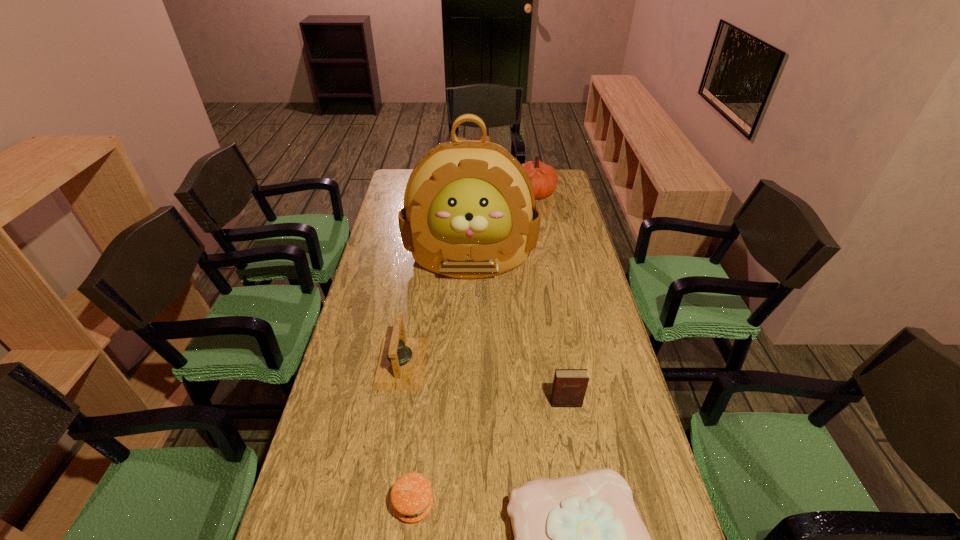
Locate an element on the screen. Image resolution: width=960 pixels, height=540 pixels. backpack is located at coordinates (469, 211).

Locate an element on the screen. This screenshot has width=960, height=540. the second farthest object is located at coordinates click(x=469, y=211).

The image size is (960, 540). Identify the location of the farthest object. (543, 177).

Where is `the fifth shortest object`? This screenshot has height=540, width=960. the fifth shortest object is located at coordinates point(543,177).

Identify the location of the third farthest object. The image size is (960, 540). (401, 363).

Find the location of a particular element. Image resolution: width=960 pixels, height=540 pixels. diary is located at coordinates (569, 387).

The image size is (960, 540). I want to click on patty, so [411, 495].

At what (x,y) coordinates should I click in order to perform the action: click on blank space located 0.360m on the front-facing side of the backpack. Please return your answer as a coordinate pair (x, y). The width and height of the screenshot is (960, 540). Looking at the image, I should click on (468, 376).

The width and height of the screenshot is (960, 540). I want to click on vacant space positioned 0.260m on the front-facing side of the pumpkin, so click(457, 192).

Where is `free space located on the front-facing side of the pumpkin`? Image resolution: width=960 pixels, height=540 pixels. free space located on the front-facing side of the pumpkin is located at coordinates (480, 192).